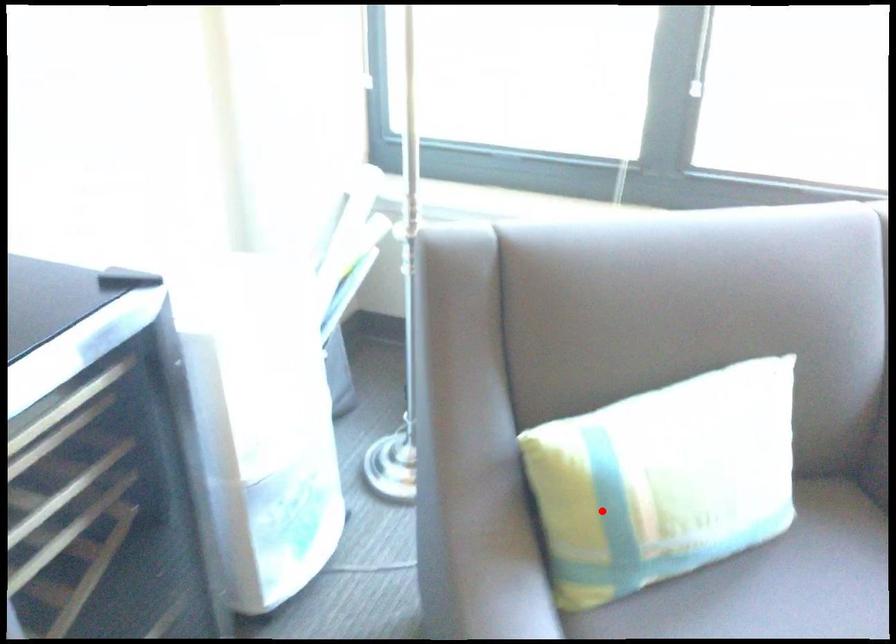
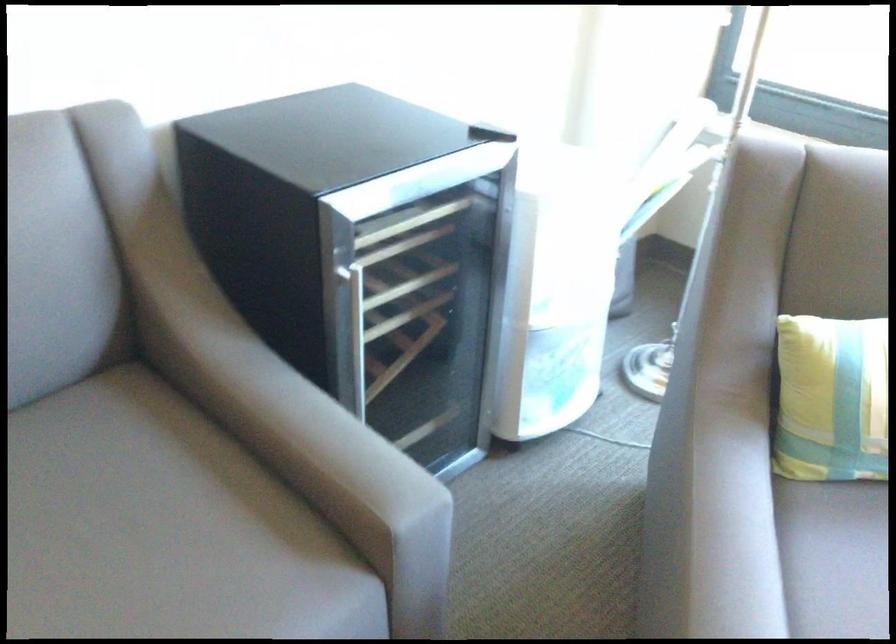
In the second image, find the point that corresponds to the highlighted location in the first image.

(831, 399)